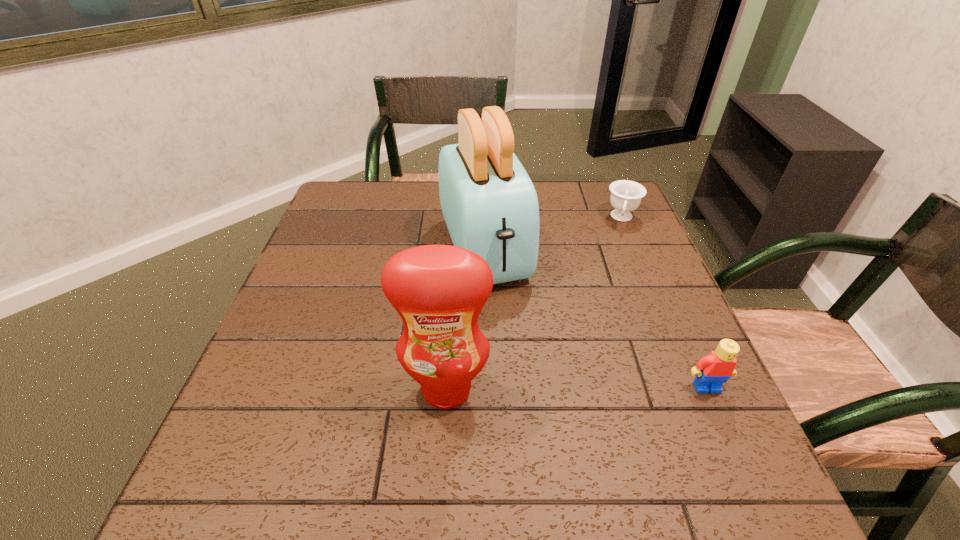
In the image, there is a desktop. Where is `vacant space at the near left corner`? vacant space at the near left corner is located at coordinates click(240, 439).

This screenshot has width=960, height=540. I want to click on free space at the near right corner of the desktop, so click(657, 420).

Where is `vacant area between the shortest object and the condiment`? This screenshot has height=540, width=960. vacant area between the shortest object and the condiment is located at coordinates (535, 303).

You are a GUI agent. You are given a task and a screenshot of the screen. Output one action in this format:
    pyautogui.click(x=<x>, y=<y>)
    Task: Click on the unoccupied position between the shortest object and the condiment
    Image resolution: width=960 pixels, height=540 pixels.
    Given the screenshot: What is the action you would take?
    pyautogui.click(x=535, y=303)

You are a GUI agent. You are given a task and a screenshot of the screen. Output one action in this format:
    pyautogui.click(x=<x>, y=<y>)
    Task: Click on the free spot between the toaster and the Lego
    The height and width of the screenshot is (540, 960).
    Given the screenshot: What is the action you would take?
    pyautogui.click(x=595, y=318)

Locate an element on the screen. The image size is (960, 540). vacant area between the Lego and the toaster is located at coordinates (595, 318).

I want to click on unoccupied position between the shortest object and the toaster, so click(553, 234).

Where is `vacant space that's between the toaster and the second shortest object`? Image resolution: width=960 pixels, height=540 pixels. vacant space that's between the toaster and the second shortest object is located at coordinates (595, 318).

In order to click on vacant space that's between the shortest object and the Lego in this screenshot , I will do `click(664, 303)`.

The height and width of the screenshot is (540, 960). In order to click on blank region between the condiment and the shortest object in this screenshot , I will do `click(535, 303)`.